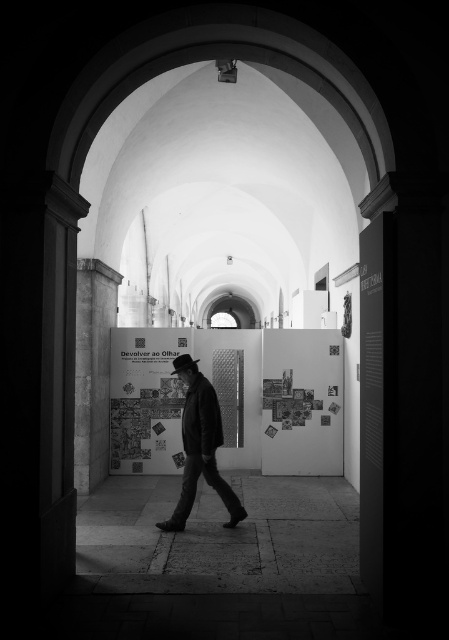
You are standing in the darkened archway of a museum corridor. You notice two points marked in the scene. Which of the two points, point (x=188, y=474) or point (x=184, y=356), is closer to you?

Point (x=188, y=474) is closer to the viewer than point (x=184, y=356).

You are an artist entering the museum through the dark archway. You see a dark textured coat at center and a black felt fedora at center. Which object is taller?

The dark textured coat at center is much taller than the black felt fedora at center.